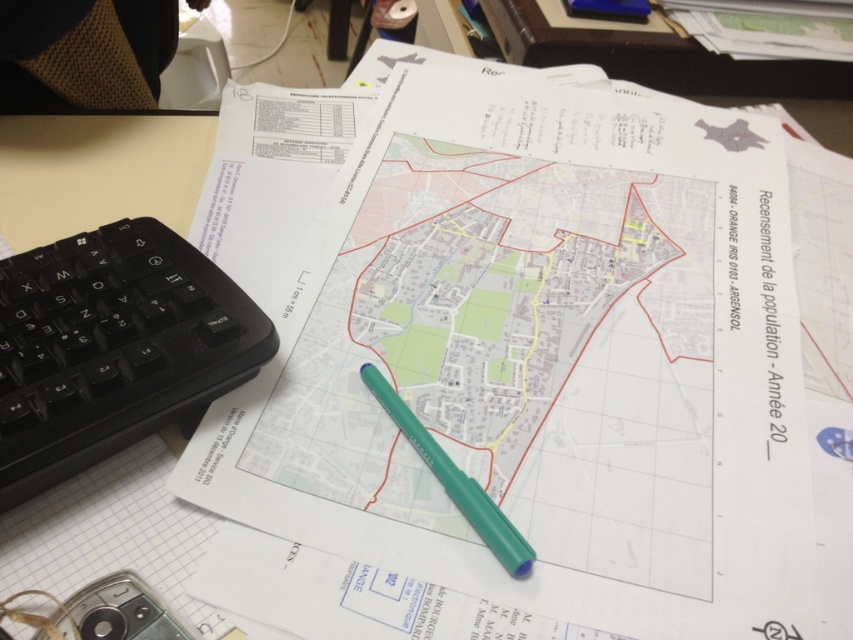
You are a census worker who needs to write notes on the map. You have a green plastic pen at center and a black plastic keyboard at lower left. Which object is taller and should you avoid knocking over while working?

The black plastic keyboard at lower left is much taller than the green plastic pen at center, so you should avoid knocking over the black plastic keyboard at lower left while working.

In the scene shown: You are a census worker who needs to write notes on the white paper at center. You have the green plastic pen at center. Can you determine if the pen will fit on the paper when you place it horizontally?

The white paper at center might be wider than green plastic pen at center, so there is a possibility that the pen will fit horizontally on the paper. However, without exact measurements, it is uncertain.

You are organizing documents on a desk and need to place a white paper at center and a black plastic keyboard at lower left. Based on the scene description, where should you place the white paper relative to the black plastic keyboard?

The white paper at center should be placed on the right side of the black plastic keyboard at lower left according to the scene description.